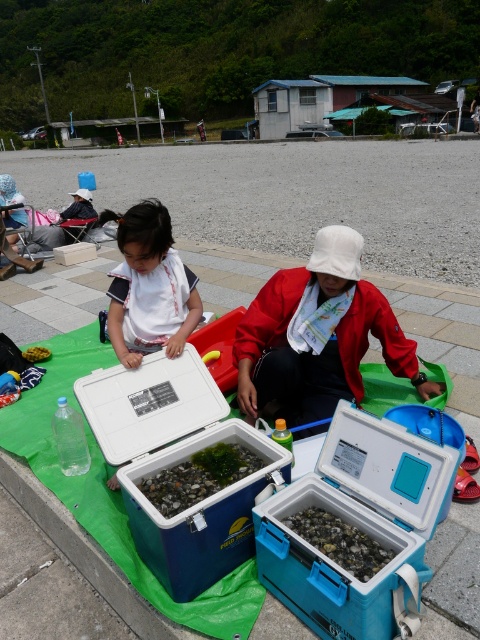
Can you confirm if paved stone pavement at center is wider than translucent plastic container at center?

Yes, paved stone pavement at center is wider than translucent plastic container at center.

Does point (409, 300) come in front of point (303, 512)?

No, it is behind (303, 512).

This screenshot has height=640, width=480. Identify the location of paved stone pavement at center. pyautogui.click(x=442, y=333).

Where is `paved stone pavement at center`? paved stone pavement at center is located at coordinates (x=442, y=333).

Between white fabric hat at center and green matte seaweed at center, which one has more height?

Standing taller between the two is white fabric hat at center.

Based on the photo, is white fabric hat at center bigger than green matte seaweed at center?

Correct, white fabric hat at center is larger in size than green matte seaweed at center.

Does point (328, 401) lie behind point (235, 451)?

Yes.

At what (x,y) coordinates should I click in order to perform the action: click on white fabric hat at center. Please return your answer as a coordinate pair (x, y). This screenshot has width=480, height=640. Looking at the image, I should click on (317, 336).

Which is in front, point (337, 433) or point (222, 452)?

Point (337, 433)

Which is behind, point (387, 426) or point (231, 472)?

The point (231, 472) is more distant.

What do you see at coordinates (358, 529) in the screenshot? Image resolution: width=480 pixels, height=640 pixels. I see `blue plastic cooler at center` at bounding box center [358, 529].

Locate an element on the screen. The image size is (480, 640). blue plastic cooler at center is located at coordinates (358, 529).